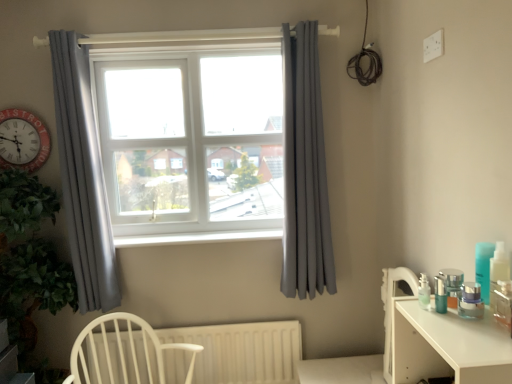
Question: Is white plastic window frame at center facing away from red plastic clock at left?

Choices:
 (A) no
 (B) yes

Answer: (A)

Question: Considering the relative sizes of white plastic window frame at center and red plastic clock at left in the image provided, is white plastic window frame at center wider than red plastic clock at left?

Choices:
 (A) no
 (B) yes

Answer: (B)

Question: Does white plastic window frame at center have a lesser height compared to red plastic clock at left?

Choices:
 (A) no
 (B) yes

Answer: (A)

Question: Does white plastic window frame at center lie in front of red plastic clock at left?

Choices:
 (A) no
 (B) yes

Answer: (A)

Question: Can you confirm if white plastic window frame at center is thinner than red plastic clock at left?

Choices:
 (A) no
 (B) yes

Answer: (A)

Question: Choose the correct answer: Is gray fabric curtain at upper left, which ranks as the 2th curtain in right-to-left order, inside white plastic window frame at center or outside it?

Choices:
 (A) inside
 (B) outside

Answer: (B)

Question: Considering their positions, is gray fabric curtain at upper left, the 1th curtain from the left, located in front of or behind white plastic window frame at center?

Choices:
 (A) behind
 (B) front

Answer: (B)

Question: From the image's perspective, is gray fabric curtain at upper left, which ranks as the 2th curtain in right-to-left order, above or below white plastic window frame at center?

Choices:
 (A) below
 (B) above

Answer: (A)

Question: Looking at their shapes, would you say gray fabric curtain at upper left, the 1th curtain from the left, is wider or thinner than white plastic window frame at center?

Choices:
 (A) thin
 (B) wide

Answer: (A)

Question: In terms of size, does gray fabric curtain at right, which is counted as the first curtain, starting from the right, appear bigger or smaller than gray fabric curtain at upper left, which ranks as the 2th curtain in right-to-left order?

Choices:
 (A) small
 (B) big

Answer: (B)

Question: Is point (309, 41) positioned closer to the camera than point (110, 223)?

Choices:
 (A) closer
 (B) farther

Answer: (A)

Question: In terms of width, does gray fabric curtain at right, which is counted as the first curtain, starting from the right, look wider or thinner when compared to gray fabric curtain at upper left, the 1th curtain from the left?

Choices:
 (A) wide
 (B) thin

Answer: (B)

Question: From their relative heights in the image, would you say gray fabric curtain at right, the second curtain from the left, is taller or shorter than gray fabric curtain at upper left, which ranks as the 2th curtain in right-to-left order?

Choices:
 (A) tall
 (B) short

Answer: (B)

Question: Looking at the image, does white plastic window sill at center seem bigger or smaller compared to white wood chair at lower left?

Choices:
 (A) big
 (B) small

Answer: (B)

Question: Would you say white plastic window sill at center is to the left or to the right of white wood chair at lower left in the picture?

Choices:
 (A) left
 (B) right

Answer: (B)